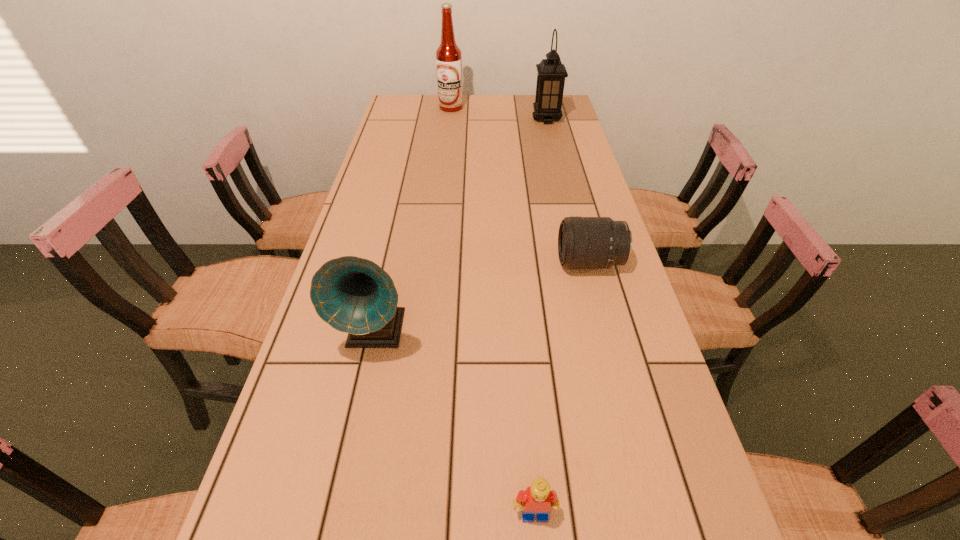
The image size is (960, 540). I want to click on free space at the far edge of the desktop, so click(x=442, y=113).

Where is `vacant space at the left edge of the desktop`? The width and height of the screenshot is (960, 540). vacant space at the left edge of the desktop is located at coordinates [371, 161].

The width and height of the screenshot is (960, 540). In order to click on vacant space at the right edge in this screenshot , I will do `click(561, 155)`.

The width and height of the screenshot is (960, 540). What are the coordinates of `free space between the alcohol and the fourth farthest object` in the screenshot? It's located at (413, 220).

At what (x,y) coordinates should I click in order to perform the action: click on free spot between the fourth nearest object and the telephoto lens. Please return your answer as a coordinate pair (x, y). Looking at the image, I should click on (568, 191).

You are a GUI agent. You are given a task and a screenshot of the screen. Output one action in this format:
    pyautogui.click(x=<x>, y=<y>)
    Task: Click on the free space between the nearest object and the third farthest object
    
    Given the screenshot: What is the action you would take?
    pyautogui.click(x=563, y=388)

The image size is (960, 540). What are the coordinates of `free space between the nearest object and the third tallest object` in the screenshot? It's located at (455, 423).

Locate an element on the screen. The image size is (960, 540). unoccupied area between the fourth shortest object and the third shortest object is located at coordinates (461, 226).

Locate an element on the screen. free space between the alcohol and the fourth farthest object is located at coordinates (413, 220).

Locate an element on the screen. free area in between the second nearest object and the Lego is located at coordinates (455, 423).